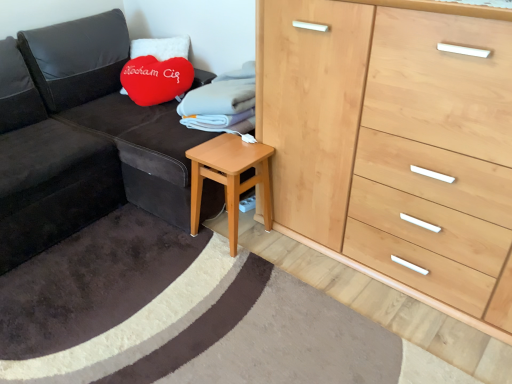
Question: In terms of width, does velvet dark gray couch at left look wider or thinner when compared to light brown wooden stool at lower center?

Choices:
 (A) wide
 (B) thin

Answer: (A)

Question: From the image's perspective, is velvet dark gray couch at left located above or below light brown wooden stool at lower center?

Choices:
 (A) below
 (B) above

Answer: (B)

Question: Based on their relative distances, which object is nearer to the velvet dark gray couch at left?

Choices:
 (A) natural wood chest of drawers at right
 (B) light brown wooden stool at lower center
 (C) velvety red heart-shaped pillow at upper left

Answer: (C)

Question: Estimate the real-world distances between objects in this image. Which object is closer to the light brown wooden stool at lower center?

Choices:
 (A) velvety red heart-shaped pillow at upper left
 (B) velvet dark gray couch at left
 (C) natural wood chest of drawers at right

Answer: (C)